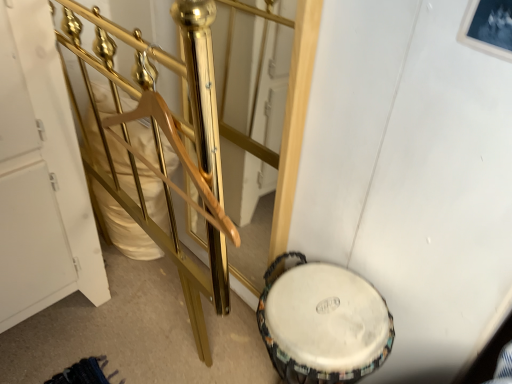
Where is `blank space above white fabric drum at lower right (from a real-world perspective)`? blank space above white fabric drum at lower right (from a real-world perspective) is located at coordinates (322, 306).